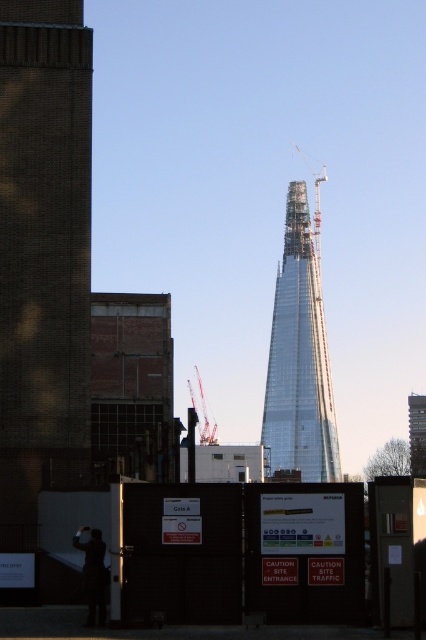
Question: Which point is farther to the camera?

Choices:
 (A) metallic gray crane at center
 (B) metallic construction crane at upper center

Answer: (B)

Question: Which object appears closest to the camera in this image?

Choices:
 (A) dark matte jacket at lower left
 (B) metallic construction crane at upper center
 (C) brick wall at left

Answer: (A)

Question: Can you confirm if dark matte jacket at lower left is bigger than metallic construction crane at upper center?

Choices:
 (A) no
 (B) yes

Answer: (A)

Question: Is glassy steel tower at center positioned in front of dark matte jacket at lower left?

Choices:
 (A) yes
 (B) no

Answer: (B)

Question: Is glassy steel tower at center closer to the viewer compared to dark matte jacket at lower left?

Choices:
 (A) no
 (B) yes

Answer: (A)

Question: Which object is farther from the camera taking this photo?

Choices:
 (A) brick wall at left
 (B) metallic construction crane at upper center

Answer: (B)